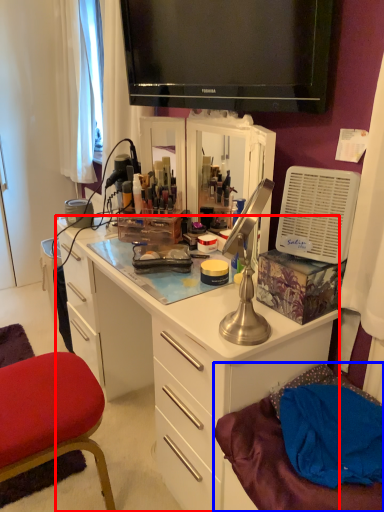
Question: Which of the following is the closest to the observer, desk (highlighted by a red box) or wide (highlighted by a blue box)?

Choices:
 (A) desk
 (B) wide

Answer: (B)